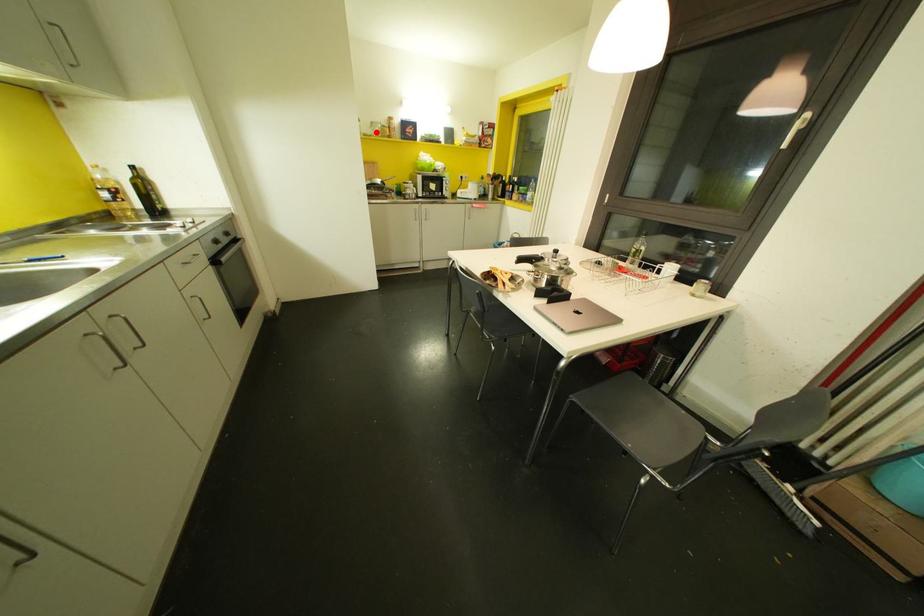
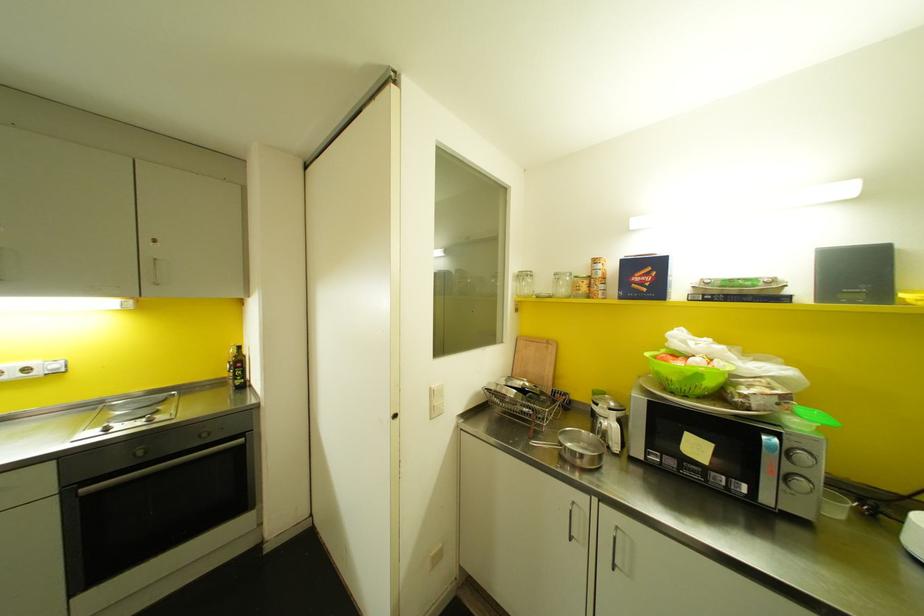
Question: A red point is marked in image1. In image2, is the corresponding 3D point closer to the camera or farther? Reply with the corresponding letter.

Choices:
 (A) The corresponding 3D point is closer.
 (B) The corresponding 3D point is farther.

Answer: (B)